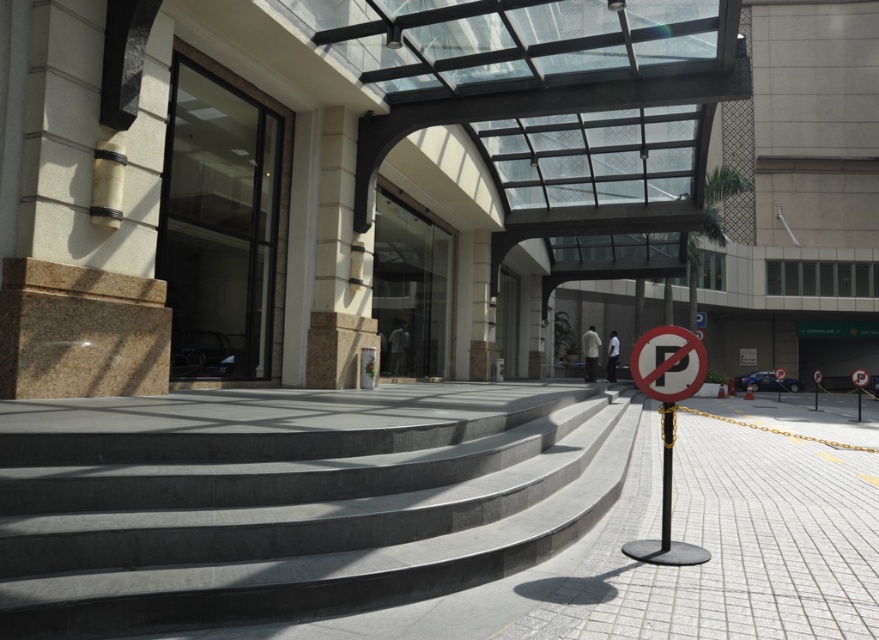
Question: Does gray concrete stairs at center have a smaller size compared to white tile pavement at center?

Choices:
 (A) yes
 (B) no

Answer: (A)

Question: Which object is positioned farthest from the white tile pavement at center?

Choices:
 (A) gray concrete stairs at center
 (B) white plastic sign at center

Answer: (B)

Question: Which of these objects is positioned farthest from the black metal pole at center?

Choices:
 (A) gray concrete stairs at center
 (B) white tile pavement at center

Answer: (B)

Question: Can you confirm if white plastic sign at center is positioned to the left of black metal pole at center?

Choices:
 (A) no
 (B) yes

Answer: (B)

Question: Which point appears closest to the camera in this image?

Choices:
 (A) (665, 548)
 (B) (764, 604)
 (C) (689, 339)

Answer: (B)

Question: Does gray concrete stairs at center appear on the left side of white plastic sign at center?

Choices:
 (A) yes
 (B) no

Answer: (A)